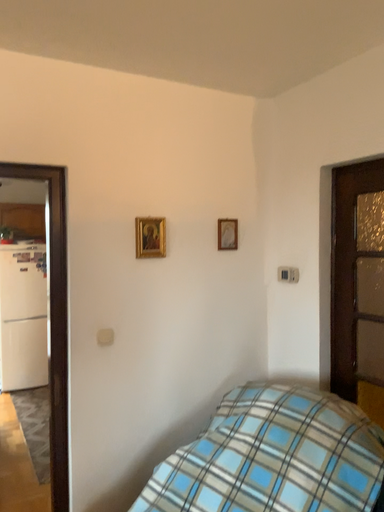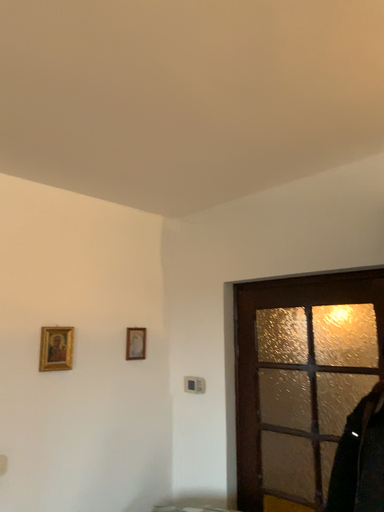
Question: Which way did the camera rotate in the video?

Choices:
 (A) rotated left
 (B) rotated right

Answer: (B)